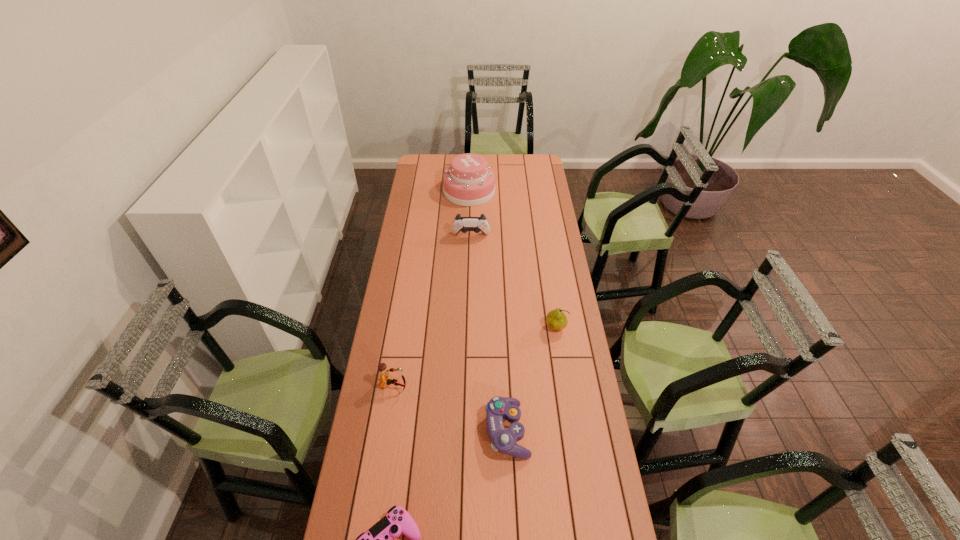
Locate an element on the screen. The image size is (960, 540). control object that ranks as the second closest to the fifth nearest object is located at coordinates (379, 539).

Locate an element on the screen. Image resolution: width=960 pixels, height=540 pixels. free space in the image that satisfies the following two spatial constraints: 1. on the front side of the third farthest object; 2. on the right side of the cake is located at coordinates tap(466, 328).

This screenshot has height=540, width=960. What are the coordinates of `blank space that satisfies the following two spatial constraints: 1. holding a crossbow in the hands of the fourth farthest object; 2. on the back side of the fifth tallest object` in the screenshot? It's located at (387, 431).